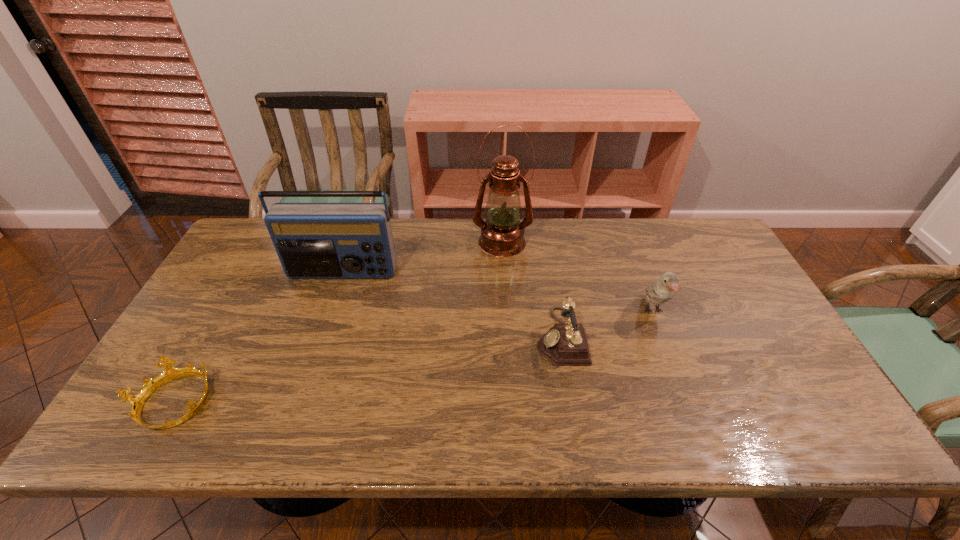
Where is `oil lamp`? oil lamp is located at coordinates (502, 235).

Locate an element on the screen. The height and width of the screenshot is (540, 960). the farthest object is located at coordinates tap(502, 235).

Where is `the fourth object from right to left`? Image resolution: width=960 pixels, height=540 pixels. the fourth object from right to left is located at coordinates (313, 240).

You are a GUI agent. You are given a task and a screenshot of the screen. Output one action in this format:
    pyautogui.click(x=<x>, y=<y>)
    Task: Click on the second tallest object
    
    Given the screenshot: What is the action you would take?
    pyautogui.click(x=313, y=240)

Where is `the rightmost object`? Image resolution: width=960 pixels, height=540 pixels. the rightmost object is located at coordinates (660, 290).

Find the location of a particular element. This screenshot has width=960, height=540. the third tallest object is located at coordinates (660, 290).

This screenshot has width=960, height=540. I want to click on telephone, so click(x=564, y=344).

I want to click on crown, so click(137, 401).

Where is `the shortest object`? This screenshot has height=540, width=960. the shortest object is located at coordinates (137, 401).

Find the location of `blank area located 0.090m on the left of the oil lamp`. blank area located 0.090m on the left of the oil lamp is located at coordinates point(446,242).